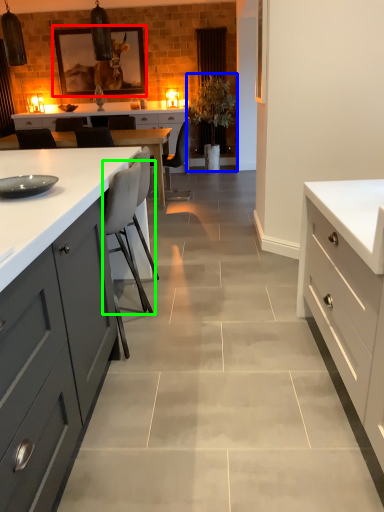
Question: Considering the real-world distances, which object is closest to picture frame (highlighted by a red box)? plant (highlighted by a blue box) or chair (highlighted by a green box).

Choices:
 (A) plant
 (B) chair

Answer: (A)